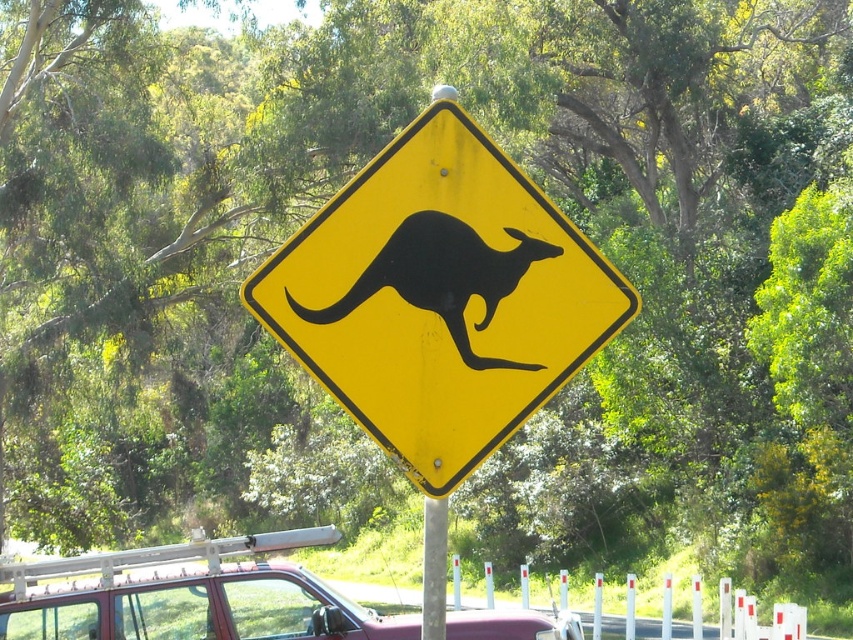
Find the location of `yellow matte sign at center`. yellow matte sign at center is located at coordinates (439, 298).

Which is in front, point (550, 371) or point (437, 566)?

Positioned in front is point (550, 371).

Who is more distant from viewer, (560, 378) or (440, 531)?

The point (440, 531) is more distant.

I want to click on yellow matte sign at center, so click(x=439, y=298).

The image size is (853, 640). Find the location of `yellow matte sign at center`. yellow matte sign at center is located at coordinates (439, 298).

The height and width of the screenshot is (640, 853). Describe the element at coordinates (439, 298) in the screenshot. I see `yellow matte sign at center` at that location.

At what (x,y) coordinates should I click in order to perform the action: click on yellow matte sign at center. Please return your answer as a coordinate pair (x, y). Looking at the image, I should click on (439, 298).

Which is more to the left, black matte/kangaroo at center or metallic gray pole at center?

black matte/kangaroo at center

Does black matte/kangaroo at center appear over metallic gray pole at center?

Correct, black matte/kangaroo at center is located above metallic gray pole at center.

Identify the location of black matte/kangaroo at center. (440, 276).